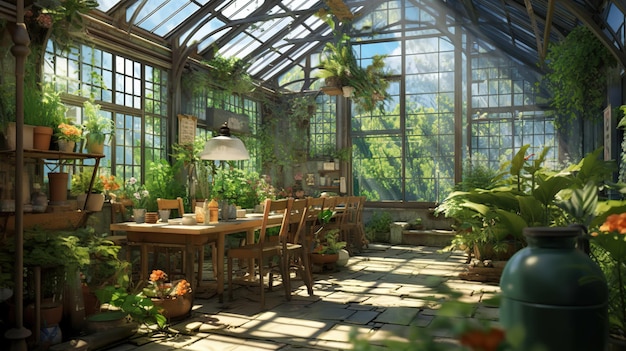
This screenshot has width=626, height=351. Identify the location of chair. (267, 211), (300, 206), (317, 202), (331, 201), (341, 201), (354, 197), (361, 197), (181, 208), (121, 221).